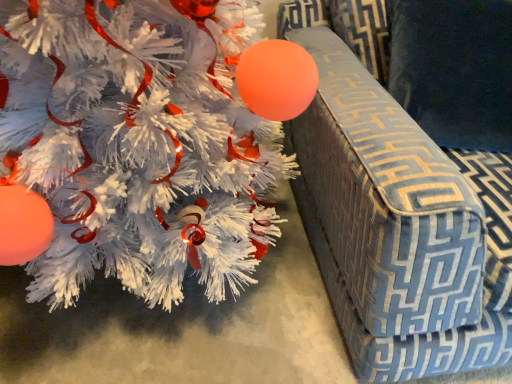
Question: Based on their sizes in the image, would you say blue patterned fabric armchair at right is bigger or smaller than velvety blue pillow at upper right?

Choices:
 (A) small
 (B) big

Answer: (B)

Question: Is blue patterned fabric armchair at right spatially inside velvety blue pillow at upper right, or outside of it?

Choices:
 (A) outside
 (B) inside

Answer: (A)

Question: Estimate the real-world distances between objects in this image. Which object is farther from the white matte christmas tree at left?

Choices:
 (A) velvety blue pillow at upper right
 (B) blue patterned fabric armchair at right

Answer: (A)

Question: Estimate the real-world distances between objects in this image. Which object is farther from the velvety blue pillow at upper right?

Choices:
 (A) white matte christmas tree at left
 (B) blue patterned fabric armchair at right

Answer: (A)